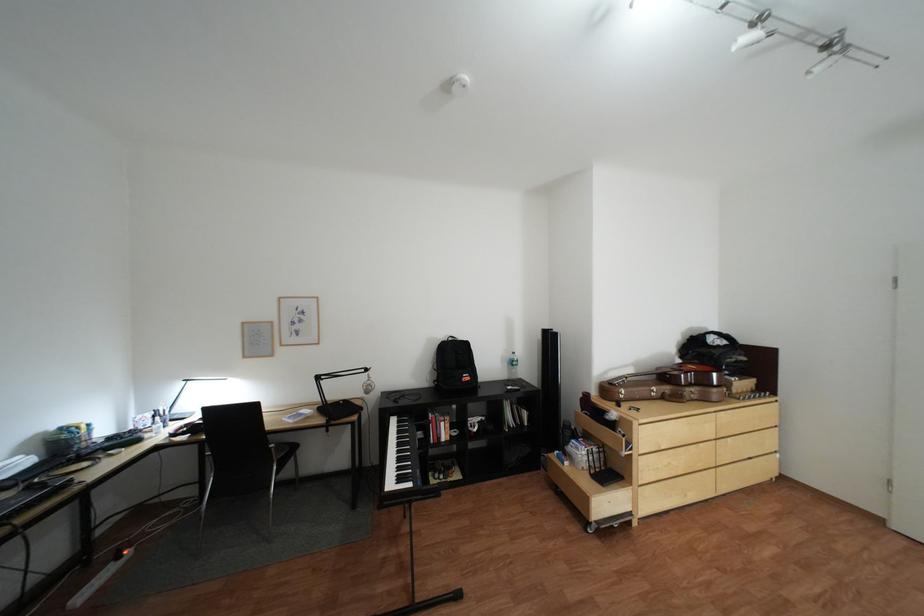
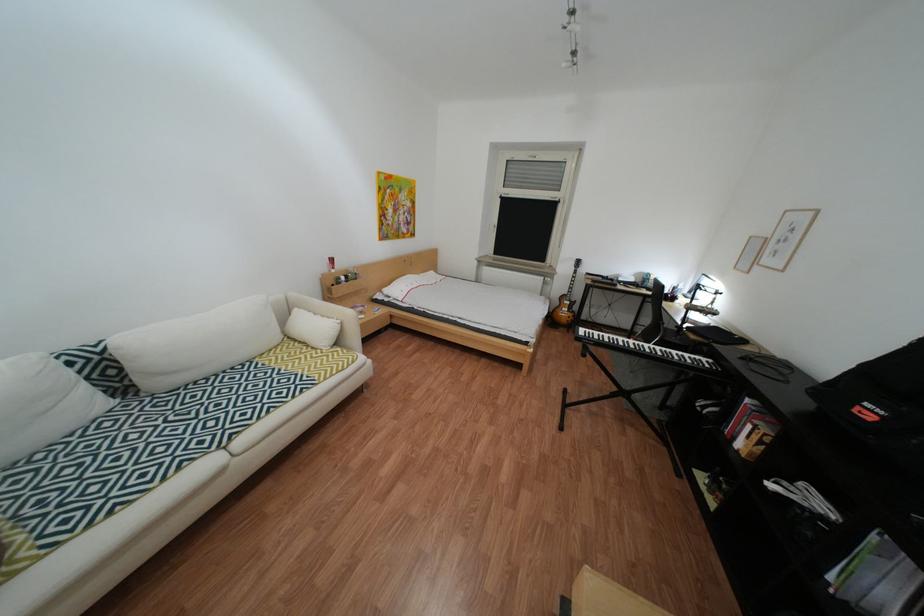
Find the pixel in the second image that matches [456,439] in the first image.

(749, 439)